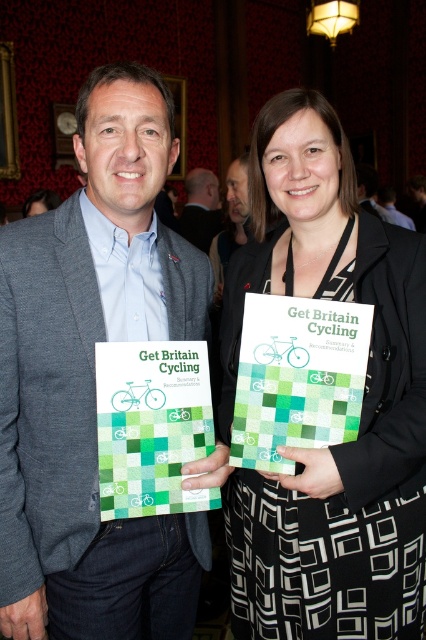
You are standing in a room with two people holding publications. There is a specific point in the room at coordinates (201, 209). What object is located at that point?

The object at point (201, 209) is the matte gray suit at center.

In the scene shown: You are a photographer at a formal event and need to position two subjects for a photo. The subjects are wearing the black textured dress at center and the matte gray suit at center. Based on their current positions, which subject should you direct to move to your left to align them properly?

The black textured dress at center is to the right of the matte gray suit at center. Therefore, you should direct the person in the matte gray suit at center to move to your left to align them properly.

You are an event planner organizing a photoshoot for the upcoming cycling campaign. You need to position the two individuals so that their suits are clearly visible. Given that the matte gray suit at center and the matte black suit at center are both present, which suit should be placed higher in the frame to ensure visibility?

The matte gray suit at center should be placed higher in the frame because it has a greater height compared to the matte black suit at center, ensuring it stands out more visually.